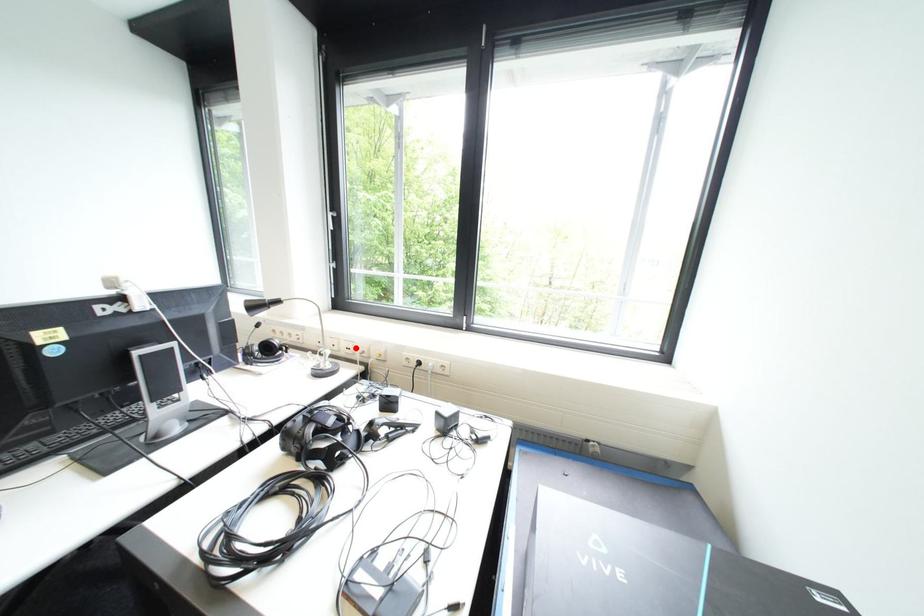
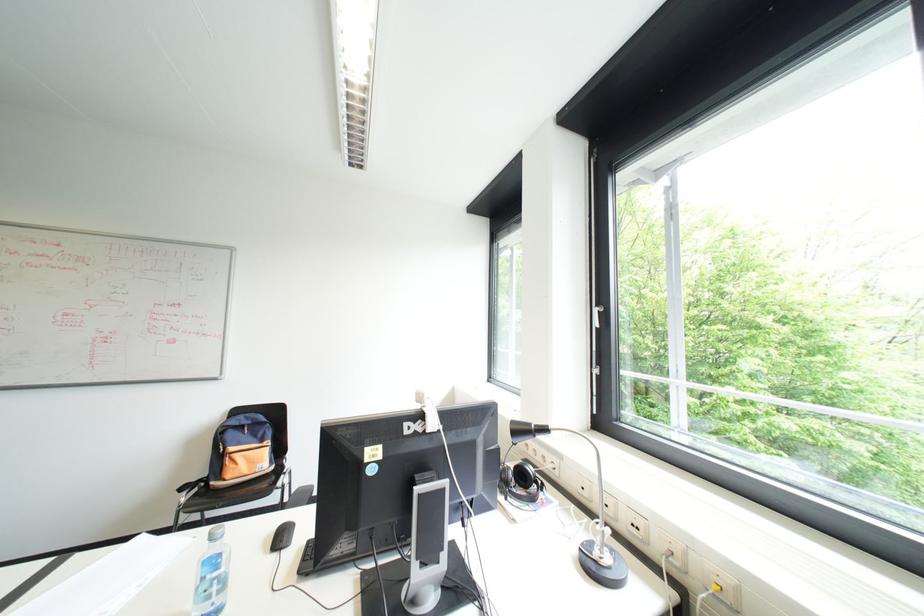
In the second image, find the point that corresponds to the highlighted location in the first image.

(640, 524)